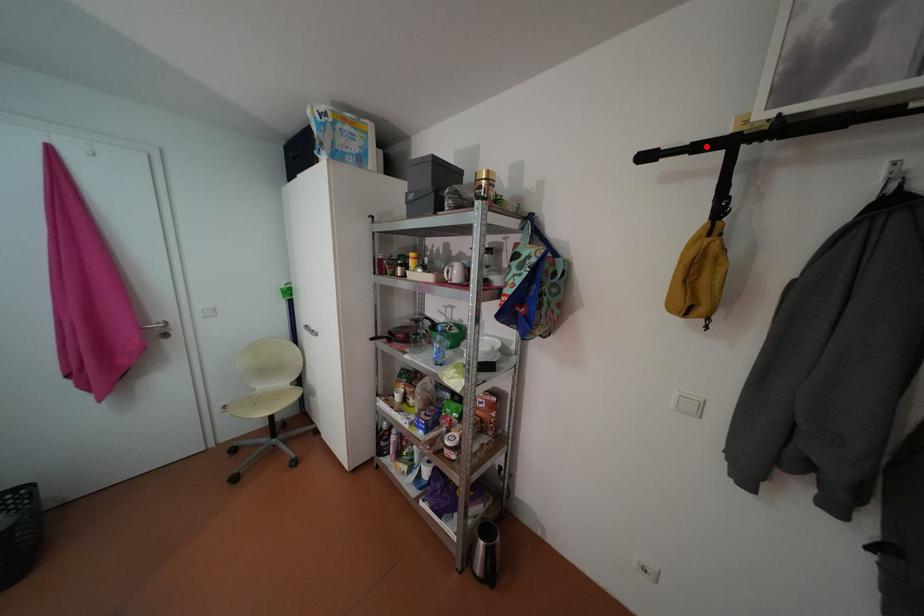
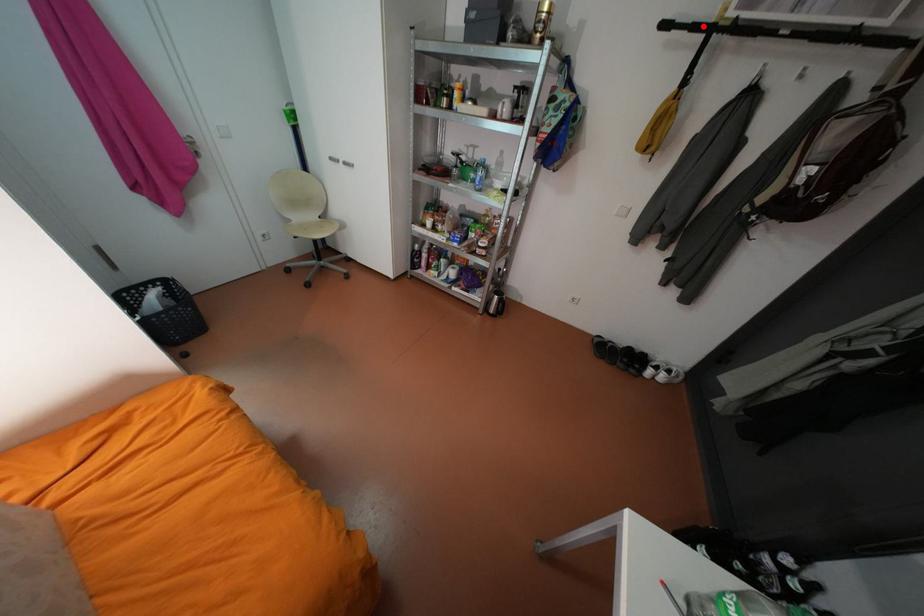
I am providing you with two images of the same scene from different viewpoints. A red point is marked on the first image and another point is marked on the second image. Does the point marked in image1 correspond to the same location as the one in image2?

Yes